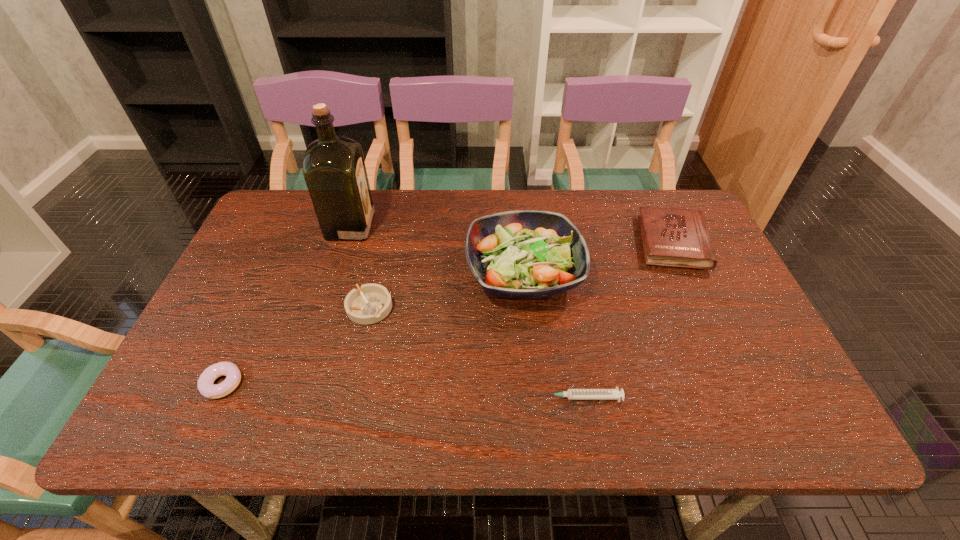
Find the location of a particular element. The width and height of the screenshot is (960, 540). object that is at the left edge is located at coordinates (205, 385).

This screenshot has height=540, width=960. Identify the location of object present at the right edge. (675, 237).

What are the coordinates of `object that is at the near left corner` in the screenshot? It's located at (205, 385).

I want to click on object positioned at the far right corner, so click(x=675, y=237).

In order to click on vacant region at the far edge of the desktop in this screenshot , I will do `click(418, 234)`.

Where is `vacant point at the near edge`? This screenshot has height=540, width=960. vacant point at the near edge is located at coordinates (714, 416).

I want to click on vacant space at the left edge of the desktop, so click(302, 241).

The image size is (960, 540). In the image, there is a desktop. What are the coordinates of `vacant space at the far left corner` in the screenshot? It's located at (303, 224).

Image resolution: width=960 pixels, height=540 pixels. Find the location of `free spot at the near right corner of the desktop`. free spot at the near right corner of the desktop is located at coordinates (785, 428).

What are the coordinates of `free space between the leftmost object and the liquor` in the screenshot? It's located at (287, 305).